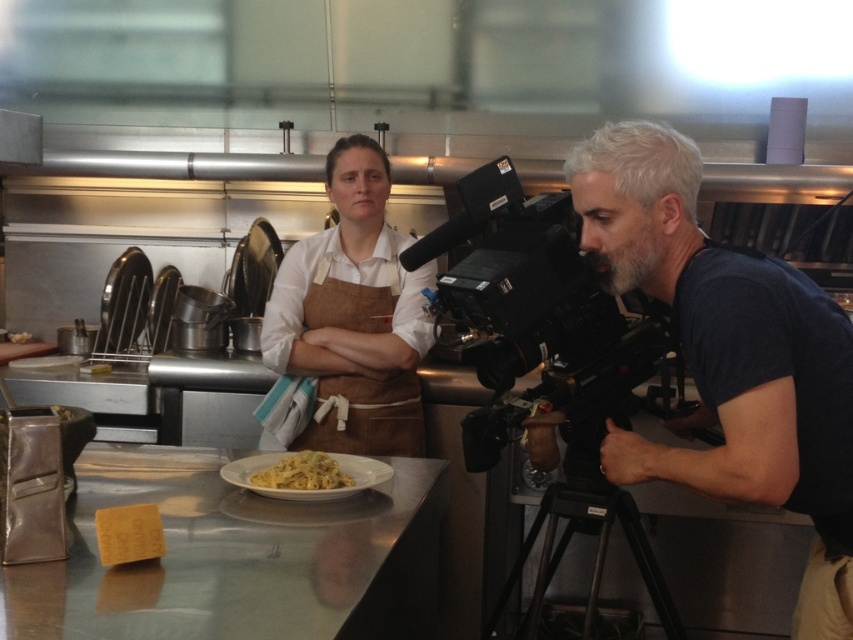
Is point (531, 605) behind point (376, 467)?

Yes, point (531, 605) is behind point (376, 467).

Does black metal tripod at lower right appear under white glossy plate at center?

Yes, black metal tripod at lower right is below white glossy plate at center.

What do you see at coordinates (596, 552) in the screenshot? I see `black metal tripod at lower right` at bounding box center [596, 552].

You are a GUI agent. You are given a task and a screenshot of the screen. Output one action in this format:
    pyautogui.click(x=<x>, y=<y>)
    Task: Click on the black metal tripod at lower right
    This screenshot has width=853, height=640.
    Given the screenshot: What is the action you would take?
    pyautogui.click(x=596, y=552)

Is black plastic video camera at right shorter than white creamy pasta at center?

No, black plastic video camera at right is not shorter than white creamy pasta at center.

Can you confirm if black plastic video camera at right is smaller than white creamy pasta at center?

Actually, black plastic video camera at right might be larger than white creamy pasta at center.

Locate an element on the screen. This screenshot has width=853, height=640. black plastic video camera at right is located at coordinates (537, 314).

Where is `black plastic video camera at right`? Image resolution: width=853 pixels, height=640 pixels. black plastic video camera at right is located at coordinates (537, 314).

Does metallic stainless steel counter at center come in front of white glossy plate at center?

Yes, it is in front of white glossy plate at center.

Identify the location of metallic stainless steel counter at center. Image resolution: width=853 pixels, height=640 pixels. (236, 557).

Does point (364, 552) come behind point (374, 483)?

No, (364, 552) is in front of (374, 483).

This screenshot has height=640, width=853. I want to click on metallic stainless steel counter at center, so click(236, 557).